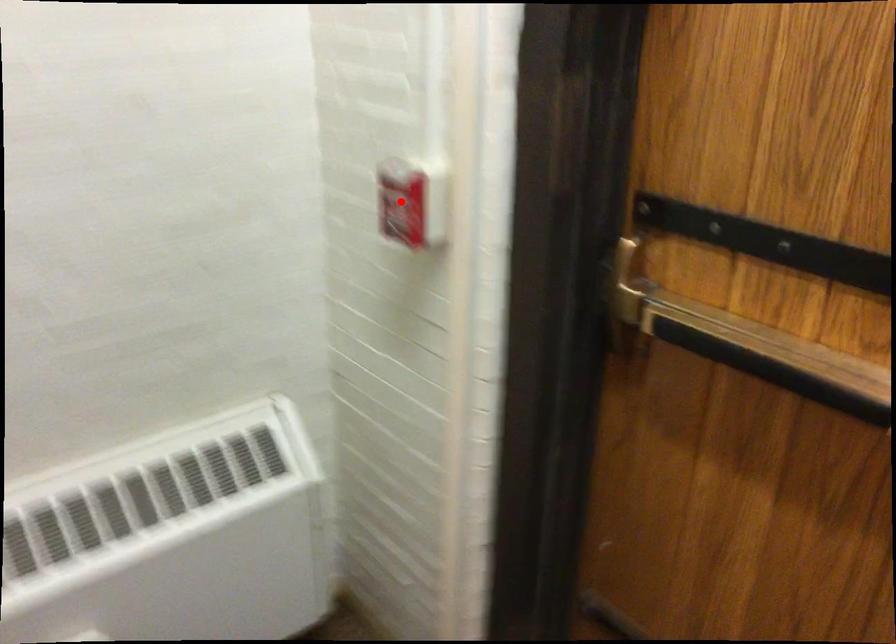
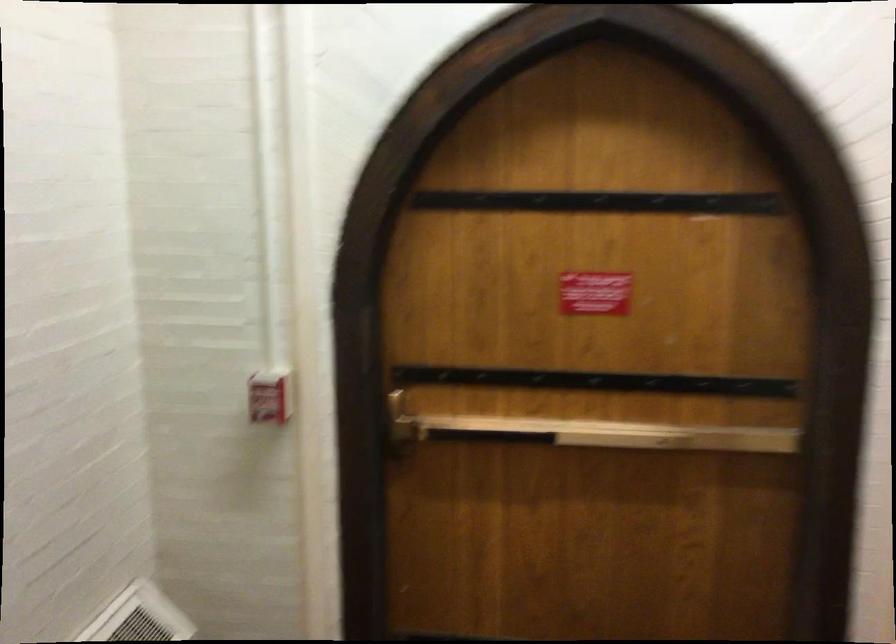
Locate, in the second image, the point that corresponds to the highlighted location in the first image.

(270, 395)